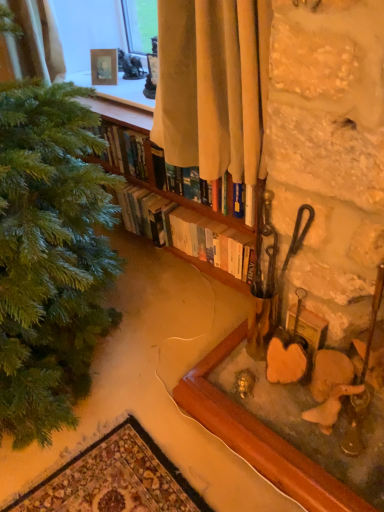
You are a GUI agent. You are given a task and a screenshot of the screen. Output one action in this format:
    pyautogui.click(x=<x>, y=<y>)
    Task: Click on the vacant space in hardcover books at center (from a real-world perspective)
    This screenshot has height=512, width=384.
    Given the screenshot: What is the action you would take?
    coord(163,265)